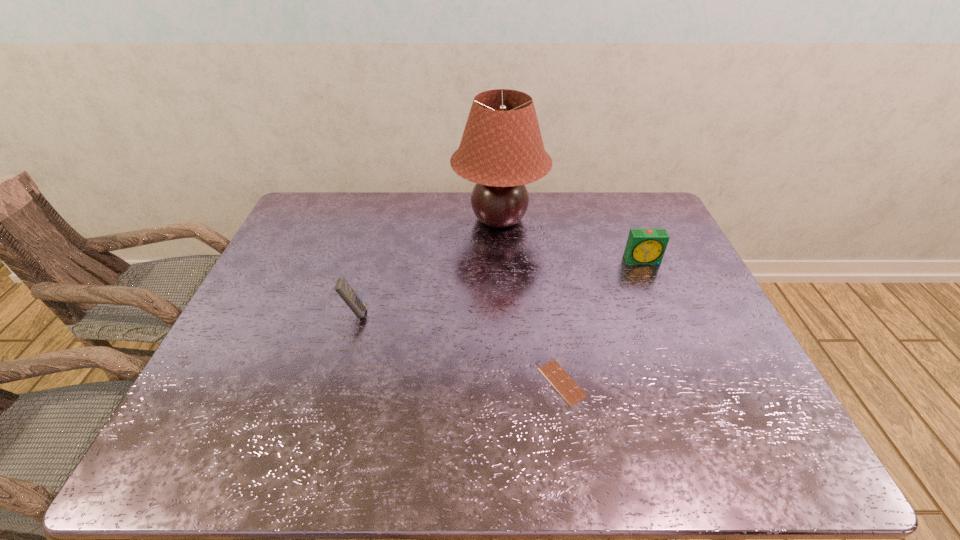
Find the location of `vacant area located on the front-facing side of the tallest object`. vacant area located on the front-facing side of the tallest object is located at coordinates 426,219.

I want to click on free space located 0.140m on the front-facing side of the third farthest object, so click(x=420, y=313).

Locate an element on the screen. The height and width of the screenshot is (540, 960). free point located 0.250m on the front-facing side of the alarm clock is located at coordinates (671, 328).

You are a GUI agent. You are given a task and a screenshot of the screen. Output one action in this format:
    pyautogui.click(x=<x>, y=<y>)
    Task: Click on the vacant space located 0.270m on the left of the nearest object
    Image resolution: width=960 pixels, height=540 pixels.
    Given the screenshot: What is the action you would take?
    pyautogui.click(x=422, y=382)

Where is `object positioned at the far edge`? object positioned at the far edge is located at coordinates (501, 150).

The width and height of the screenshot is (960, 540). Find the location of `object that is positioned at the right edge`. object that is positioned at the right edge is located at coordinates (644, 246).

Find the location of a particular element. The image size is (960, 540). vacant space at the far edge of the desktop is located at coordinates (585, 210).

This screenshot has width=960, height=540. Find the location of `free space at the near edge of the desktop`. free space at the near edge of the desktop is located at coordinates (322, 440).

Find the location of a particular element. vacant region at the left edge of the desktop is located at coordinates (229, 334).

The image size is (960, 540). In order to click on free location at the right edge of the desktop in this screenshot , I will do `click(708, 306)`.